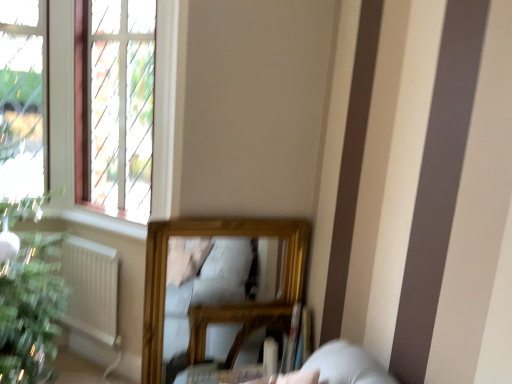
Question: Is clear glass window at upper left positioned with its back to green matte houseplant at lower left?

Choices:
 (A) yes
 (B) no

Answer: (B)

Question: Can you confirm if clear glass window at upper left is shorter than green matte houseplant at lower left?

Choices:
 (A) no
 (B) yes

Answer: (A)

Question: Can you confirm if clear glass window at upper left is thinner than green matte houseplant at lower left?

Choices:
 (A) yes
 (B) no

Answer: (B)

Question: Can you confirm if clear glass window at upper left is bigger than green matte houseplant at lower left?

Choices:
 (A) no
 (B) yes

Answer: (B)

Question: Is green matte houseplant at lower left a part of clear glass window at upper left?

Choices:
 (A) no
 (B) yes

Answer: (A)

Question: Is wooden table at lower center inside or outside of green matte houseplant at lower left?

Choices:
 (A) inside
 (B) outside

Answer: (B)

Question: Considering their positions, is wooden table at lower center located in front of or behind green matte houseplant at lower left?

Choices:
 (A) front
 (B) behind

Answer: (A)

Question: Looking at the image, does wooden table at lower center seem bigger or smaller compared to green matte houseplant at lower left?

Choices:
 (A) small
 (B) big

Answer: (B)

Question: Considering the positions of wooden table at lower center and green matte houseplant at lower left in the image, is wooden table at lower center wider or thinner than green matte houseplant at lower left?

Choices:
 (A) wide
 (B) thin

Answer: (A)

Question: Is wooden table at lower center wider or thinner than white matte radiator at lower left?

Choices:
 (A) wide
 (B) thin

Answer: (A)

Question: Is wooden table at lower center inside or outside of white matte radiator at lower left?

Choices:
 (A) outside
 (B) inside

Answer: (A)

Question: Considering their positions, is wooden table at lower center located in front of or behind white matte radiator at lower left?

Choices:
 (A) behind
 (B) front

Answer: (B)

Question: From the image's perspective, is wooden table at lower center positioned above or below white matte radiator at lower left?

Choices:
 (A) below
 (B) above

Answer: (A)

Question: From a real-world perspective, is white matte radiator at lower left positioned above or below wooden table at lower center?

Choices:
 (A) below
 (B) above

Answer: (B)

Question: Choose the correct answer: Is white matte radiator at lower left inside wooden table at lower center or outside it?

Choices:
 (A) outside
 (B) inside

Answer: (A)